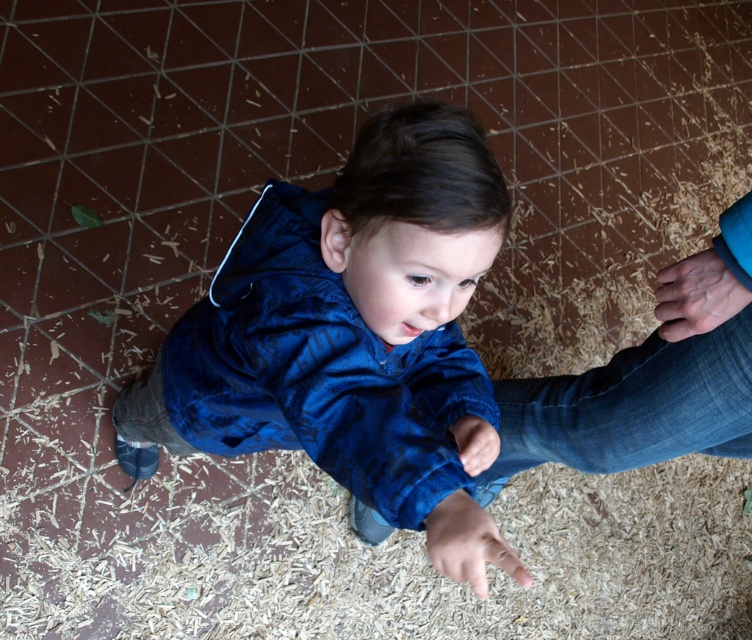
Who is shorter, blue velvety jacket at center or denim at lower right?

With less height is denim at lower right.

Does point (161, 381) lie in front of point (714, 362)?

No, it is not.

Is point (464, 173) positioned before point (508, 422)?

Yes.

This screenshot has height=640, width=752. Find the location of `blue velvety jacket at center`. blue velvety jacket at center is located at coordinates (352, 337).

Measure the distance between denim at lower right and camera.

denim at lower right and camera are 1.20 meters apart.

Does point (693, 362) come closer to viewer compared to point (441, 570)?

No.

This screenshot has height=640, width=752. I want to click on denim at lower right, so click(x=632, y=406).

In order to click on denim at lower right in this screenshot , I will do `click(632, 406)`.

Looking at this image, does blue velvety jacket at center have a greater width compared to smooth skin hand at lower right?

Correct, the width of blue velvety jacket at center exceeds that of smooth skin hand at lower right.

Who is more distant from viewer, (344, 300) or (690, 291)?

Point (690, 291)

Which is in front, point (464, 212) or point (719, 291)?

Point (464, 212) is in front.

I want to click on blue velvety jacket at center, so click(x=352, y=337).